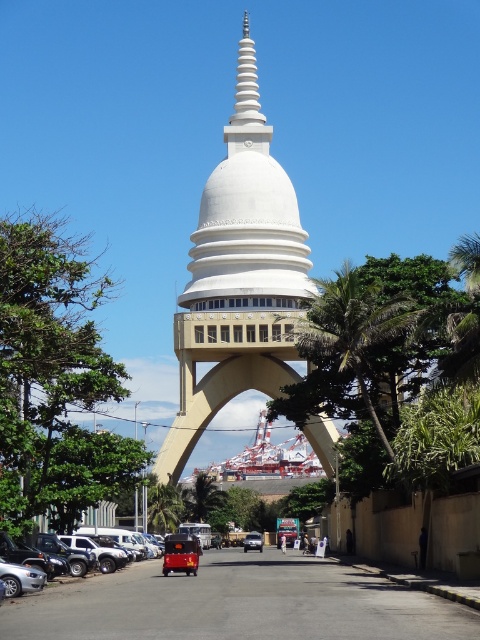
Question: Which is farther from the silver metallic car at lower left?

Choices:
 (A) white smooth stupa at center
 (B) metallic silver car at center

Answer: (A)

Question: Does silver metallic car at lower left appear on the left side of metallic silver car at center?

Choices:
 (A) no
 (B) yes

Answer: (B)

Question: Which object appears farthest from the camera in this image?

Choices:
 (A) silver metallic car at lower left
 (B) white smooth stupa at center

Answer: (B)

Question: Is white smooth stupa at center to the right of metallic silver car at center from the viewer's perspective?

Choices:
 (A) yes
 (B) no

Answer: (B)

Question: Does white smooth stupa at center have a larger size compared to silver metallic car at lower left?

Choices:
 (A) no
 (B) yes

Answer: (B)

Question: Among these objects, which one is farthest from the camera?

Choices:
 (A) white smooth stupa at center
 (B) silver metallic car at lower left

Answer: (A)